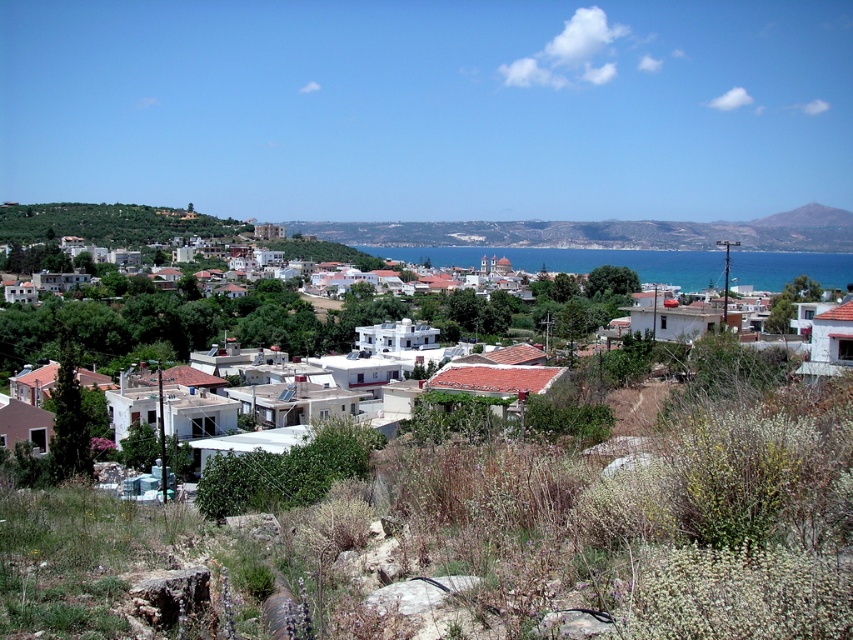
Consider the image. You are a tourist standing on the cliff overlooking the white matte houses at center and the blue water at center. Which object is higher in elevation?

The white matte houses at center are higher in elevation than the blue water at center because they are located above it.

You are a tourist standing at the edge of the coastal town and want to take a photo that includes both the white matte houses at center and the blue water at center. Which object will occupy more of the horizontal space in your photo?

The white matte houses at center will occupy more horizontal space in the photo since their width is larger than that of the blue water at center.

You are standing on a cliff overlooking the coastal town. You see the white matte houses at center and the blue water at center. Which one is nearer to you?

The white matte houses at center are closer to the viewer than the blue water at center.